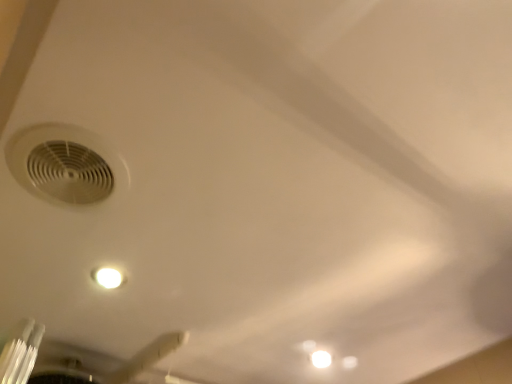
Question: Does point [68, 152] appear closer or farther from the camera than point [98, 372]?

Choices:
 (A) farther
 (B) closer

Answer: (B)

Question: Considering the positions of white matte air conditioning at upper left and white matte ceiling fan at lower left in the image, is white matte air conditioning at upper left wider or thinner than white matte ceiling fan at lower left?

Choices:
 (A) wide
 (B) thin

Answer: (B)

Question: Considering the positions of white matte air conditioning at upper left and white matte ceiling fan at lower left in the image, is white matte air conditioning at upper left taller or shorter than white matte ceiling fan at lower left?

Choices:
 (A) tall
 (B) short

Answer: (B)

Question: Looking at their shapes, would you say white matte ceiling fan at lower left is wider or thinner than white matte air conditioning at upper left?

Choices:
 (A) wide
 (B) thin

Answer: (A)

Question: In terms of height, does white matte ceiling fan at lower left look taller or shorter compared to white matte air conditioning at upper left?

Choices:
 (A) tall
 (B) short

Answer: (A)

Question: From the image's perspective, is white matte ceiling fan at lower left above or below white matte air conditioning at upper left?

Choices:
 (A) below
 (B) above

Answer: (A)

Question: Which is correct: white matte ceiling fan at lower left is inside white matte air conditioning at upper left, or outside of it?

Choices:
 (A) outside
 (B) inside

Answer: (A)